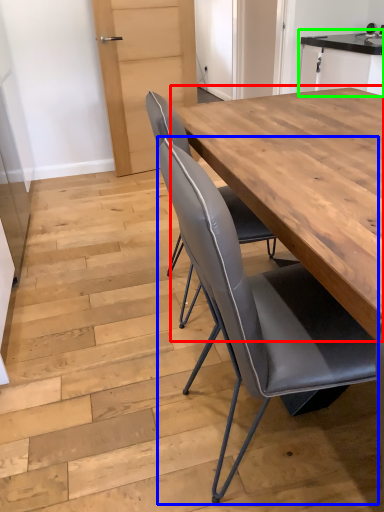
Question: Based on their relative distances, which object is farther from table (highlighted by a red box)? Choose from chair (highlighted by a blue box) and cabinetry (highlighted by a green box).

Choices:
 (A) chair
 (B) cabinetry

Answer: (B)